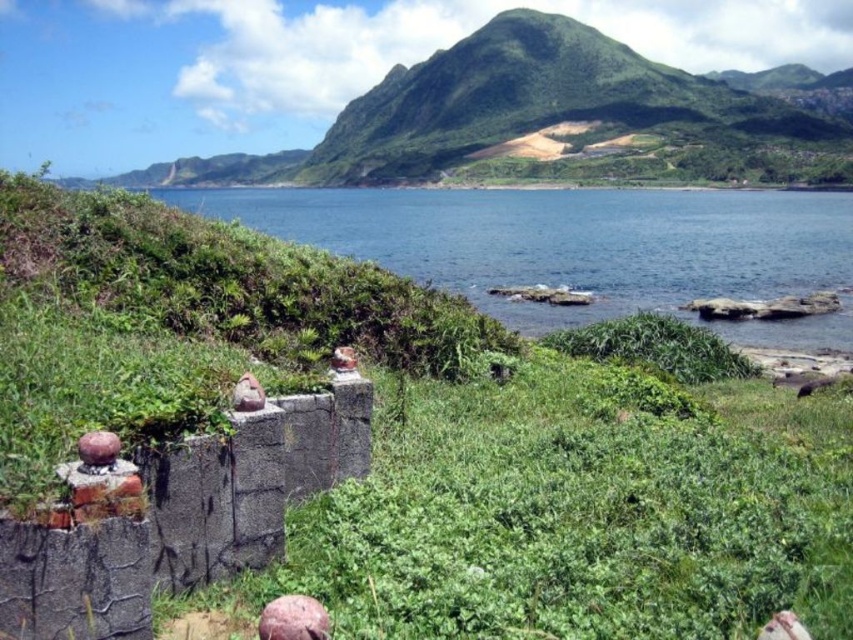
You are a hiker standing at the base of the green grassy mountain at upper center and looking out towards the blue water at center. Which object appears taller from your perspective?

The green grassy mountain at upper center appears taller than the blue water at center from your perspective.

You are a hiker standing at the base of the green grassy mountain at upper center. You want to reach the blue water at center. Which direction should you walk to get there?

The blue water at center is behind the green grassy mountain at upper center, so you should walk away from the mountain to reach the blue water at center.